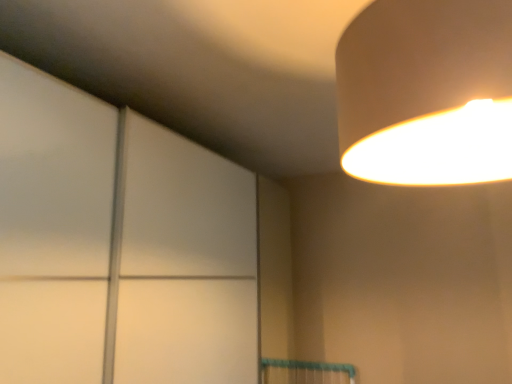
This screenshot has width=512, height=384. Identify the location of transparent glass door at upper left. (118, 245).

What do you see at coordinates (118, 245) in the screenshot? This screenshot has width=512, height=384. I see `transparent glass door at upper left` at bounding box center [118, 245].

Describe the element at coordinates (426, 92) in the screenshot. Image resolution: width=512 pixels, height=384 pixels. I see `matte white lampshade at upper right` at that location.

The image size is (512, 384). I want to click on matte white lampshade at upper right, so (426, 92).

Image resolution: width=512 pixels, height=384 pixels. What are the coordinates of `transparent glass door at upper left` in the screenshot? It's located at (118, 245).

Is transparent glass door at upper left to the left of matte white lampshade at upper right from the viewer's perspective?

Indeed, transparent glass door at upper left is positioned on the left side of matte white lampshade at upper right.

Is the position of transparent glass door at upper left more distant than that of matte white lampshade at upper right?

That is True.

Which point is more forward, [13,306] or [478,22]?

The point [478,22] is in front.

From the image's perspective, which one is positioned higher, transparent glass door at upper left or matte white lampshade at upper right?

matte white lampshade at upper right, from the image's perspective.

From a real-world perspective, is transparent glass door at upper left on top of matte white lampshade at upper right?

No, from a real-world perspective, transparent glass door at upper left is not above matte white lampshade at upper right.

Is transparent glass door at upper left thinner than matte white lampshade at upper right?

No, transparent glass door at upper left is not thinner than matte white lampshade at upper right.

From their relative heights in the image, would you say transparent glass door at upper left is taller or shorter than matte white lampshade at upper right?

In the image, transparent glass door at upper left appears to be taller than matte white lampshade at upper right.

Does transparent glass door at upper left have a larger size compared to matte white lampshade at upper right?

Yes, transparent glass door at upper left is bigger than matte white lampshade at upper right.

Is transparent glass door at upper left situated inside matte white lampshade at upper right or outside?

transparent glass door at upper left is not enclosed by matte white lampshade at upper right.

Are transparent glass door at upper left and matte white lampshade at upper right making contact?

No, transparent glass door at upper left is not in contact with matte white lampshade at upper right.

Is transparent glass door at upper left oriented towards matte white lampshade at upper right?

Yes, transparent glass door at upper left is oriented towards matte white lampshade at upper right.

How many degrees apart are the facing directions of transparent glass door at upper left and matte white lampshade at upper right?

179 degrees.

Locate an element on the screen. This screenshot has width=512, height=384. glass door that is behind the matte white lampshade at upper right is located at coordinates (118, 245).

Is matte white lampshade at upper right at the left side of transparent glass door at upper left?

No, matte white lampshade at upper right is not to the left of transparent glass door at upper left.

Considering the positions of objects matte white lampshade at upper right and transparent glass door at upper left in the image provided, who is in front, matte white lampshade at upper right or transparent glass door at upper left?

matte white lampshade at upper right.

Which is in front, point (453, 160) or point (108, 213)?

The point (453, 160) is in front.

From the image's perspective, is matte white lampshade at upper right beneath transparent glass door at upper left?

No, from the image's perspective, matte white lampshade at upper right is not beneath transparent glass door at upper left.

From a real-world perspective, is matte white lampshade at upper right on top of transparent glass door at upper left?

Indeed, from a real-world perspective, matte white lampshade at upper right stands above transparent glass door at upper left.

Considering the sizes of objects matte white lampshade at upper right and transparent glass door at upper left in the image provided, who is thinner, matte white lampshade at upper right or transparent glass door at upper left?

With smaller width is matte white lampshade at upper right.

Considering the sizes of objects matte white lampshade at upper right and transparent glass door at upper left in the image provided, who is shorter, matte white lampshade at upper right or transparent glass door at upper left?

With less height is matte white lampshade at upper right.

Considering the relative sizes of matte white lampshade at upper right and transparent glass door at upper left in the image provided, is matte white lampshade at upper right smaller than transparent glass door at upper left?

Yes.

Would you say matte white lampshade at upper right is inside or outside transparent glass door at upper left?

matte white lampshade at upper right is outside transparent glass door at upper left.

Is matte white lampshade at upper right not near transparent glass door at upper left?

They are positioned close to each other.

Is matte white lampshade at upper right oriented away from transparent glass door at upper left?

No, matte white lampshade at upper right's orientation is not away from transparent glass door at upper left.

The image size is (512, 384). I want to click on glass door beneath the matte white lampshade at upper right (from a real-world perspective), so click(118, 245).

The height and width of the screenshot is (384, 512). Find the location of `glass door that appears below the matte white lampshade at upper right (from a real-world perspective)`. glass door that appears below the matte white lampshade at upper right (from a real-world perspective) is located at coordinates (118, 245).

Find the location of `glass door located below the matte white lampshade at upper right (from the image's perspective)`. glass door located below the matte white lampshade at upper right (from the image's perspective) is located at coordinates (118, 245).